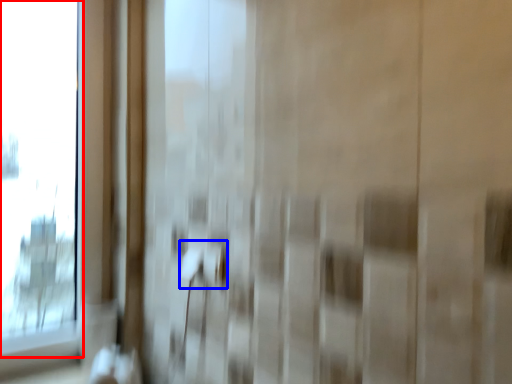
Question: Among these objects, which one is nearest to the camera, window (highlighted by a red box) or door handle (highlighted by a blue box)?

Choices:
 (A) window
 (B) door handle

Answer: (B)